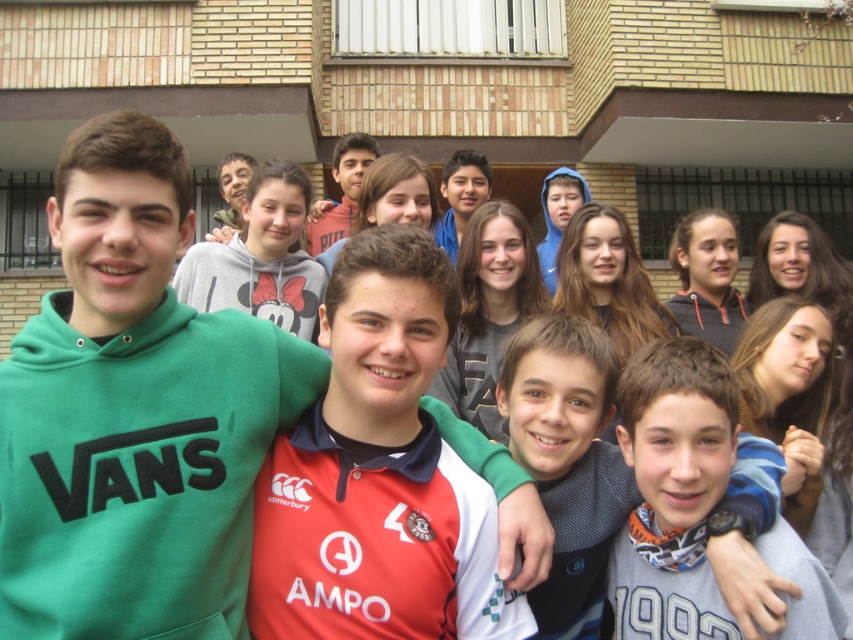
Question: Which of the following is the farthest from the observer?

Choices:
 (A) (575, 216)
 (B) (216, 298)

Answer: (A)

Question: Which is farther from the matte green hoodie at center?

Choices:
 (A) matte blue hoodie at center
 (B) green fleece at center

Answer: (B)

Question: Is red jersey at center to the right of matte blue hoodie at center from the viewer's perspective?

Choices:
 (A) no
 (B) yes

Answer: (A)

Question: Can you confirm if gray knit sweater at center is smaller than smooth brown hair at center?

Choices:
 (A) no
 (B) yes

Answer: (B)

Question: Can you confirm if green fleece at center is positioned below red jersey at center?

Choices:
 (A) no
 (B) yes

Answer: (A)

Question: Which of the following is the farthest from the observer?

Choices:
 (A) smooth brown hair at center
 (B) green fleece at center
 (C) matte blue hoodie at center
 (D) gray knit sweater at center

Answer: (C)